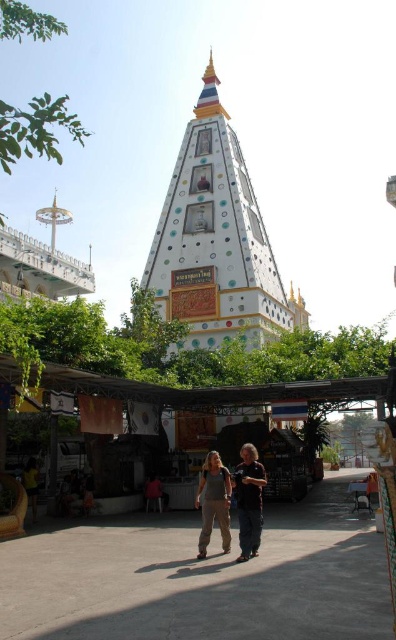
Question: Does white painted stupa at center appear over dark brown leather jacket at center?

Choices:
 (A) yes
 (B) no

Answer: (A)

Question: Which object is farther from the camera taking this photo?

Choices:
 (A) dark gray fabric couple at center
 (B) white painted stupa at center
 (C) denim pants at center

Answer: (B)

Question: Is white painted stupa at center wider than dark brown leather jacket at center?

Choices:
 (A) no
 (B) yes

Answer: (B)

Question: Which object is positioned closest to the dark gray fabric couple at center?

Choices:
 (A) denim pants at center
 (B) white painted stupa at center
 (C) dark brown leather jacket at center

Answer: (C)

Question: Which of these objects is positioned farthest from the dark gray fabric couple at center?

Choices:
 (A) dark brown leather jacket at center
 (B) denim pants at center
 (C) white painted stupa at center

Answer: (C)

Question: Does white painted stupa at center have a lesser width compared to dark brown leather jacket at center?

Choices:
 (A) yes
 (B) no

Answer: (B)